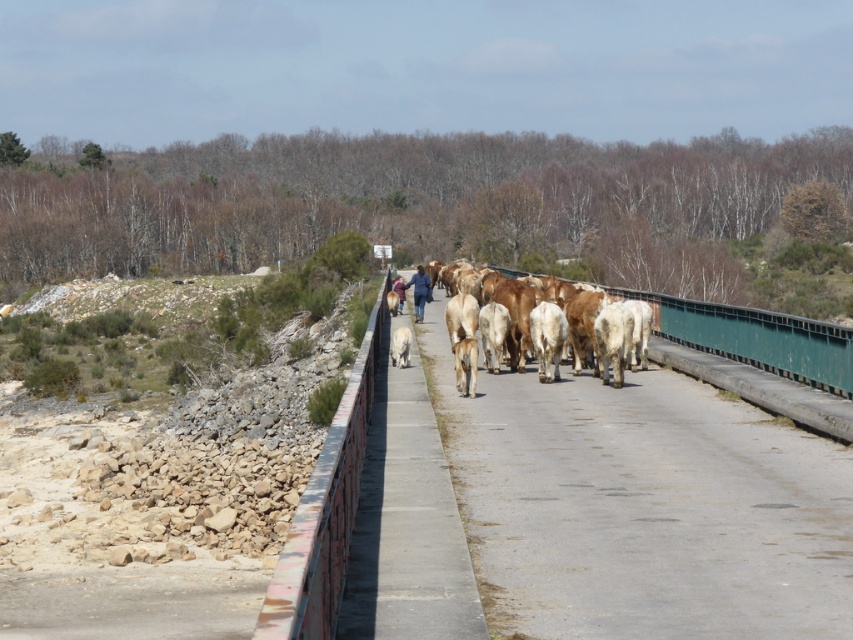
Does brown smooth cows at center lie behind white fur dog at center?

No, brown smooth cows at center is closer to the viewer.

Can you confirm if brown smooth cows at center is smaller than white fur dog at center?

No, brown smooth cows at center is not smaller than white fur dog at center.

Does point (616, 358) come in front of point (401, 342)?

Yes, it is in front of point (401, 342).

This screenshot has width=853, height=640. I want to click on brown smooth cows at center, so click(x=606, y=330).

Is point (468, 372) closer to viewer compared to point (397, 352)?

Yes, it is.

Between point (459, 392) and point (392, 346), which one is positioned in front?

Point (459, 392) is more forward.

Describe the element at coordinates (465, 365) in the screenshot. I see `white smooth cow at center` at that location.

The width and height of the screenshot is (853, 640). Find the location of `white smooth cow at center`. white smooth cow at center is located at coordinates (465, 365).

From the picture: Between brown smooth cows at center and white smooth cow at center, which one appears on the right side from the viewer's perspective?

brown smooth cows at center is more to the right.

Can you confirm if brown smooth cows at center is positioned to the left of white smooth cow at center?

No, brown smooth cows at center is not to the left of white smooth cow at center.

Is point (618, 336) farther from viewer compared to point (469, 374)?

Yes, point (618, 336) is behind point (469, 374).

Image resolution: width=853 pixels, height=640 pixels. Find the location of `brown smooth cows at center`. brown smooth cows at center is located at coordinates (606, 330).